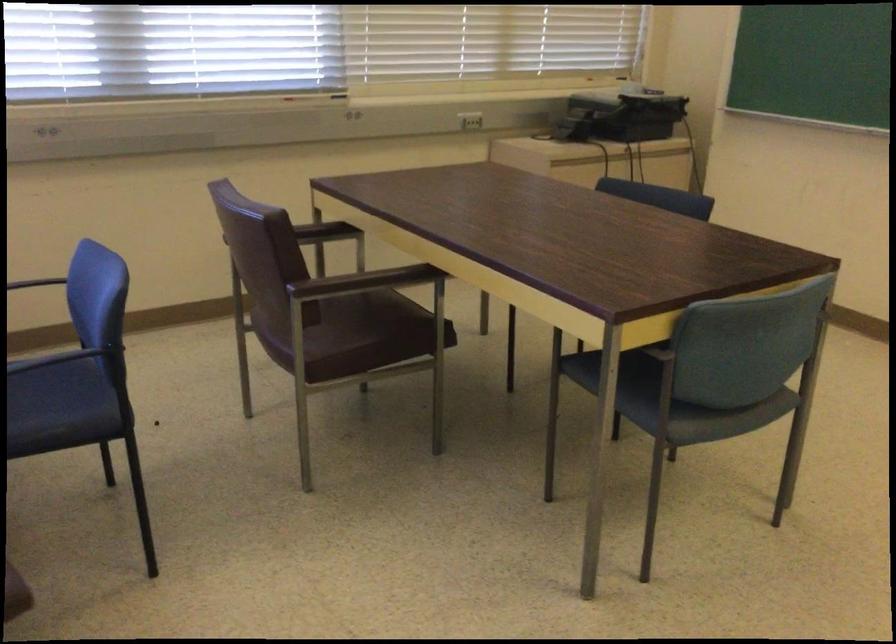
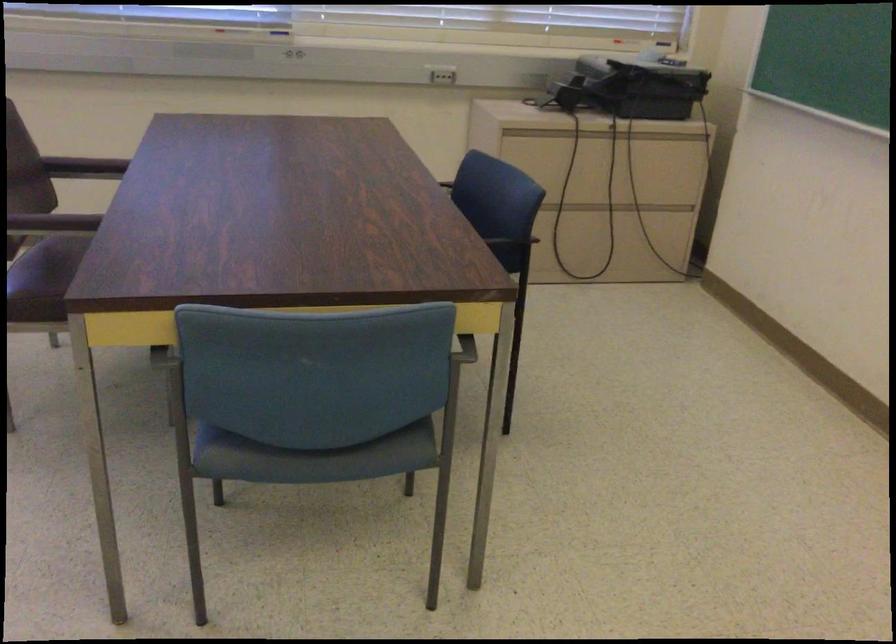
The images are taken continuously from a first-person perspective. In which direction are you moving?

The cameraman moved toward right, forward.